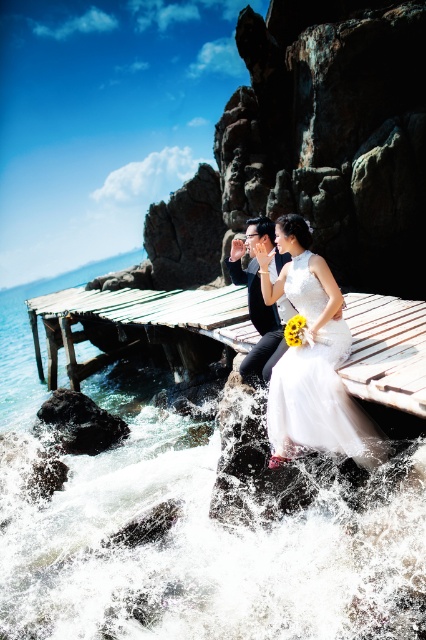
Question: From the image, what is the correct spatial relationship of white frothy water at lower center in relation to weathered wood dock at center?

Choices:
 (A) above
 (B) below

Answer: (B)

Question: Estimate the real-world distances between objects in this image. Which object is closer to the matte black suit at center?

Choices:
 (A) white frothy water at lower center
 (B) white satin dress at center
 (C) weathered wood dock at center

Answer: (B)

Question: Which of the following is the farthest from the observer?

Choices:
 (A) (262, 236)
 (B) (325, 300)
 (C) (244, 340)

Answer: (C)

Question: Which point appears closest to the camera in this image?

Choices:
 (A) (37, 564)
 (B) (0, 320)
 (C) (147, 321)
 (D) (268, 435)

Answer: (D)

Question: Does clear blue water at dock left have a lesser width compared to matte black suit at center?

Choices:
 (A) yes
 (B) no

Answer: (B)

Question: Is white frothy water at lower center wider than clear blue water at dock left?

Choices:
 (A) yes
 (B) no

Answer: (B)